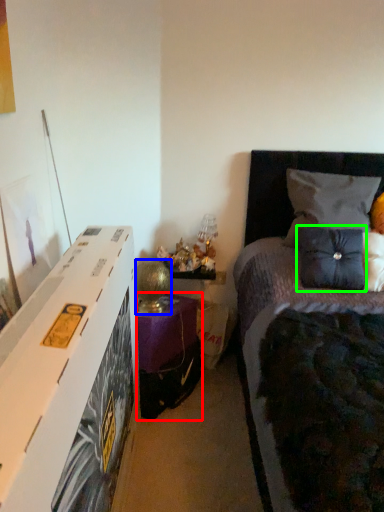
Question: Which object is the closest to the nightstand (highlighted by a red box)? Choose among these: table lamp (highlighted by a blue box) or pillow (highlighted by a green box).

Choices:
 (A) table lamp
 (B) pillow

Answer: (A)